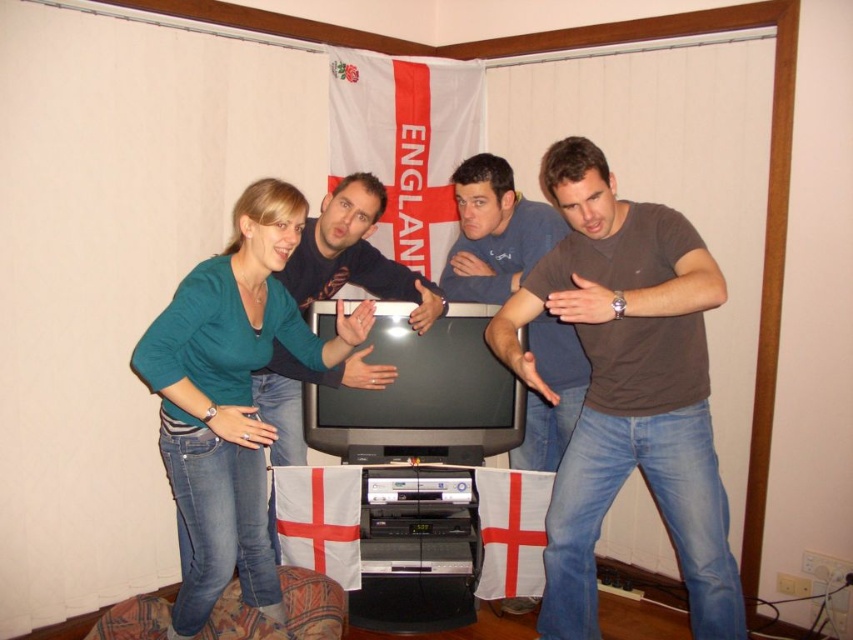
You are standing in the living room and want to locate the green matte shirt at center. According to the coordinates given, where would you look to find it?

The green matte shirt at center is located at the 2D coordinates point (230, 397).

You are standing in the living room and see two points marked on the wall. The first point is at coordinates point (235, 445) and the second is at point (529, 460). Which point is closer to you?

Point (235, 445) is closer to the viewer than point (529, 460) according to the description.